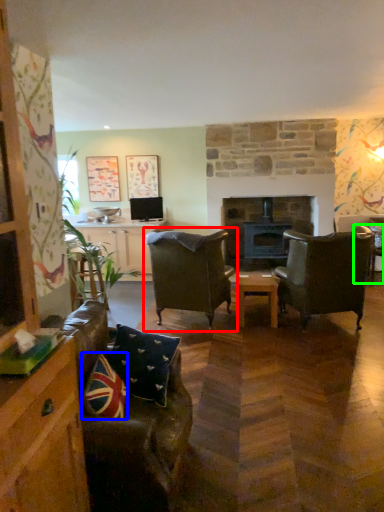
Question: Considering the real-world distances, which object is farthest from chair (highlighted by a red box)? pillow (highlighted by a blue box) or chair (highlighted by a green box)?

Choices:
 (A) pillow
 (B) chair

Answer: (B)